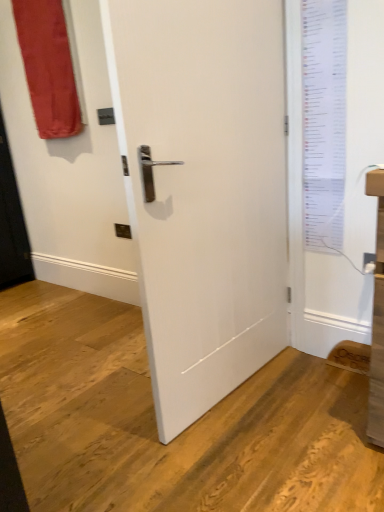
Question: Is white paper list at upper right surrounding white matte door at center?

Choices:
 (A) no
 (B) yes

Answer: (A)

Question: From a real-world perspective, is white paper list at upper right beneath white matte door at center?

Choices:
 (A) yes
 (B) no

Answer: (B)

Question: Is white paper list at upper right placed right next to white matte door at center?

Choices:
 (A) yes
 (B) no

Answer: (B)

Question: Is white paper list at upper right aimed at white matte door at center?

Choices:
 (A) no
 (B) yes

Answer: (A)

Question: Is white paper list at upper right wider than white matte door at center?

Choices:
 (A) yes
 (B) no

Answer: (B)

Question: Considering the relative sizes of white paper list at upper right and white matte door at center in the image provided, is white paper list at upper right smaller than white matte door at center?

Choices:
 (A) yes
 (B) no

Answer: (A)

Question: Can you confirm if white paper list at upper right is thinner than matte red curtain at upper left?

Choices:
 (A) yes
 (B) no

Answer: (A)

Question: Is white paper list at upper right surrounding matte red curtain at upper left?

Choices:
 (A) yes
 (B) no

Answer: (B)

Question: Is white paper list at upper right smaller than matte red curtain at upper left?

Choices:
 (A) yes
 (B) no

Answer: (A)

Question: Can you confirm if white paper list at upper right is wider than matte red curtain at upper left?

Choices:
 (A) yes
 (B) no

Answer: (B)

Question: Is white paper list at upper right taller than matte red curtain at upper left?

Choices:
 (A) no
 (B) yes

Answer: (B)

Question: Is white paper list at upper right located outside matte red curtain at upper left?

Choices:
 (A) no
 (B) yes

Answer: (B)

Question: Is matte red curtain at upper left to the left of white paper list at upper right from the viewer's perspective?

Choices:
 (A) yes
 (B) no

Answer: (A)